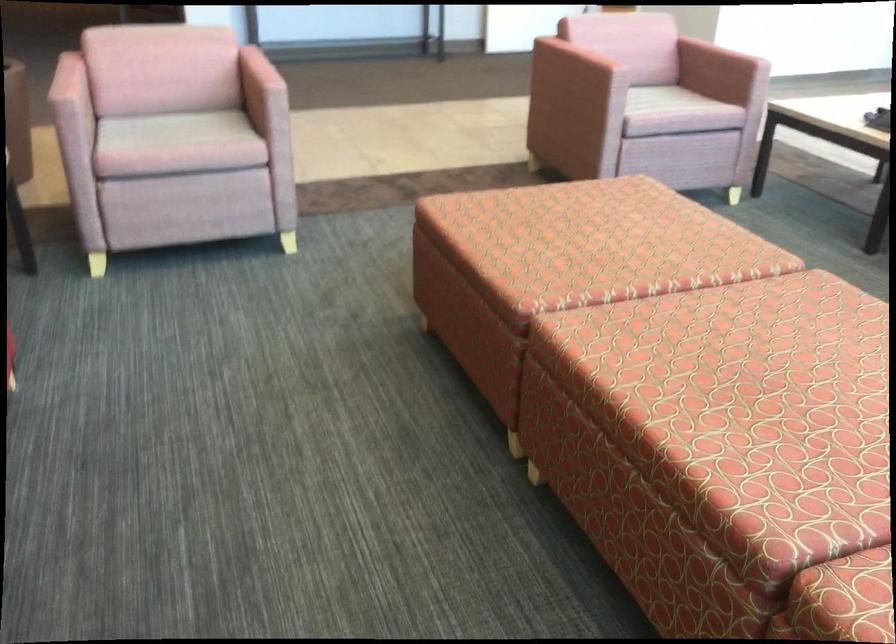
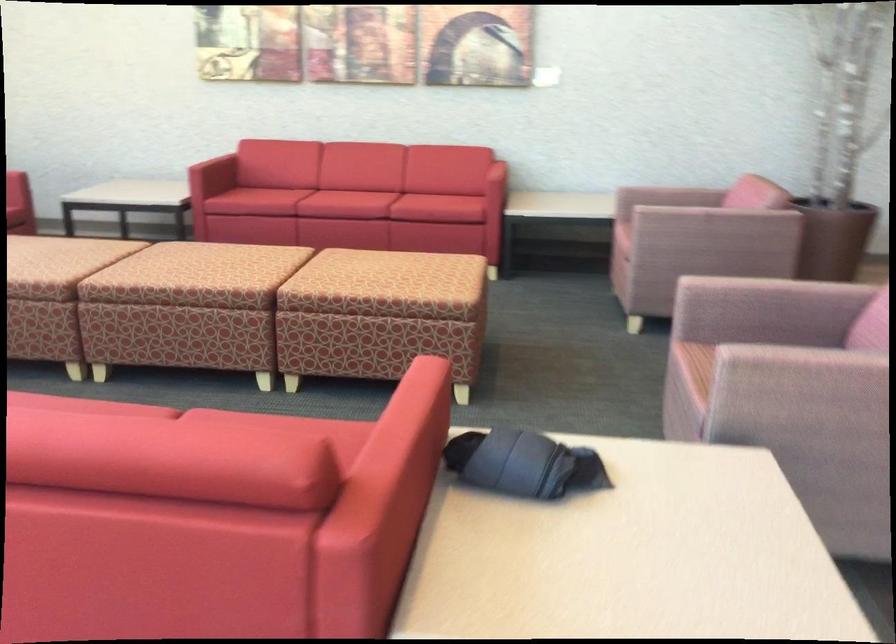
Where in the second image is the point corresponding to point 633,234 from the first image?

(385, 270)